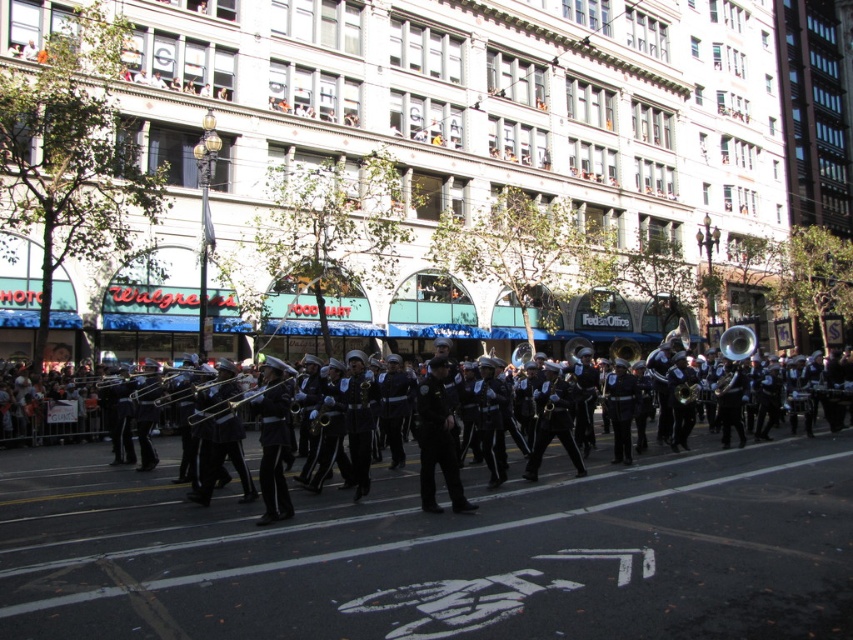
Which is more to the left, shiny black uniforms at center or brass shiny tuba at right?

Positioned to the left is shiny black uniforms at center.

Who is more forward, (x=160, y=484) or (x=746, y=326)?

Point (x=160, y=484) is in front.

The width and height of the screenshot is (853, 640). I want to click on shiny black uniforms at center, so click(x=44, y=416).

Measure the distance from shiny silver trombone at center to shiny silver trumpet at center.

30.45 inches

Which is in front, point (260, 394) or point (173, 396)?

Point (260, 394) is in front.

Identify the location of shiny silver trombone at center. The image size is (853, 640). (253, 392).

Locate an element on the screen. shiny silver trombone at center is located at coordinates (253, 392).

How much distance is there between dark blue uniform at center and shiny brass trumpet at center?

They are 2.93 meters apart.

Does point (421, 435) come closer to viewer compared to point (564, 392)?

Yes, point (421, 435) is closer to viewer.

Identify the location of dark blue uniform at center. (437, 440).